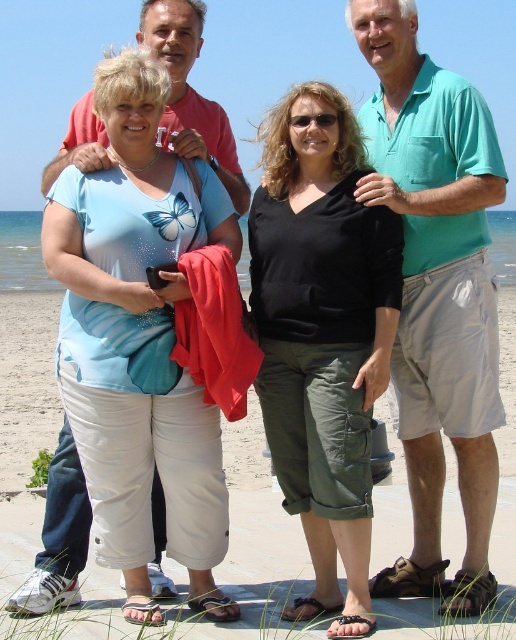
Does black cotton shirt at center have a lesser width compared to teal cotton shirt at upper right?

Yes.

Is black cotton shirt at center bigger than teal cotton shirt at upper right?

No, black cotton shirt at center is not bigger than teal cotton shirt at upper right.

Which is in front, point (291, 470) or point (470, 608)?

Point (470, 608) is in front.

The image size is (516, 640). Identify the location of black cotton shirt at center. (322, 333).